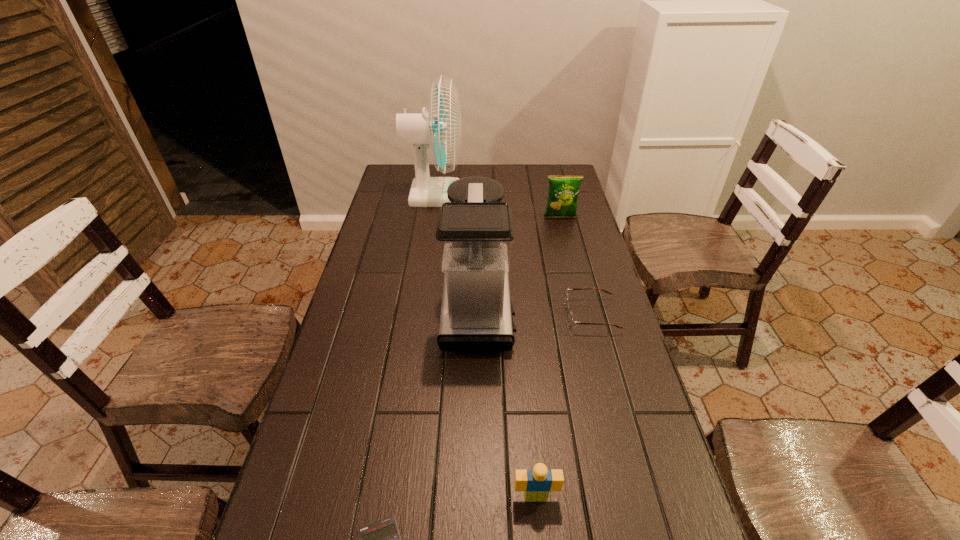
I want to click on vacant space located on the front-facing side of the spectacles, so click(516, 315).

Identify the location of free space located on the front-facing side of the spectacles. (512, 315).

The width and height of the screenshot is (960, 540). Find the location of `object situated at the far edge`. object situated at the far edge is located at coordinates (439, 128).

Locate an element on the screen. Image resolution: width=960 pixels, height=540 pixels. object located in the left edge section of the desktop is located at coordinates (439, 128).

Image resolution: width=960 pixels, height=540 pixels. Find the location of `crisp (potato chip) positioned at the right edge`. crisp (potato chip) positioned at the right edge is located at coordinates (563, 192).

Image resolution: width=960 pixels, height=540 pixels. I want to click on spectacles at the right edge, so click(x=571, y=321).

In order to click on object that is positioned at the far left corner in this screenshot , I will do `click(439, 128)`.

The width and height of the screenshot is (960, 540). I want to click on free region at the far edge of the desktop, so click(434, 176).

What are the coordinates of `vacant space at the left edge of the desktop` in the screenshot? It's located at (377, 355).

Identify the location of free space at the right edge. This screenshot has height=540, width=960. (558, 265).